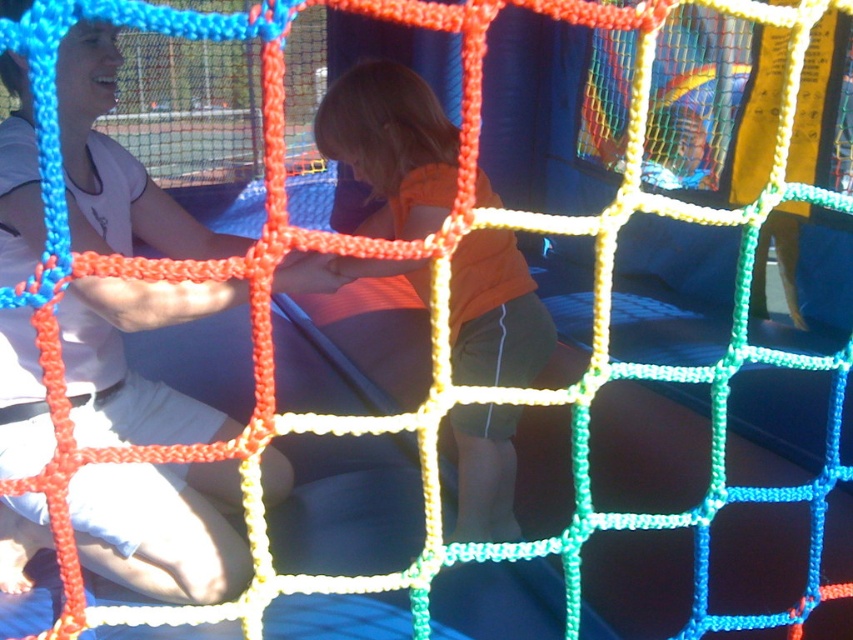
Is matte white shirt at center smaller than orange cotton shirt at center?

No, matte white shirt at center is not smaller than orange cotton shirt at center.

Is point (144, 593) positioned behind point (450, 172)?

No.

Does point (45, 531) come behind point (483, 257)?

No, it is in front of (483, 257).

You are a GUI agent. You are given a task and a screenshot of the screen. Output one action in this format:
    pyautogui.click(x=<x>, y=<y>)
    Task: Click on the matte white shirt at center
    Image resolution: width=853 pixels, height=640 pixels.
    Given the screenshot: What is the action you would take?
    pyautogui.click(x=161, y=529)